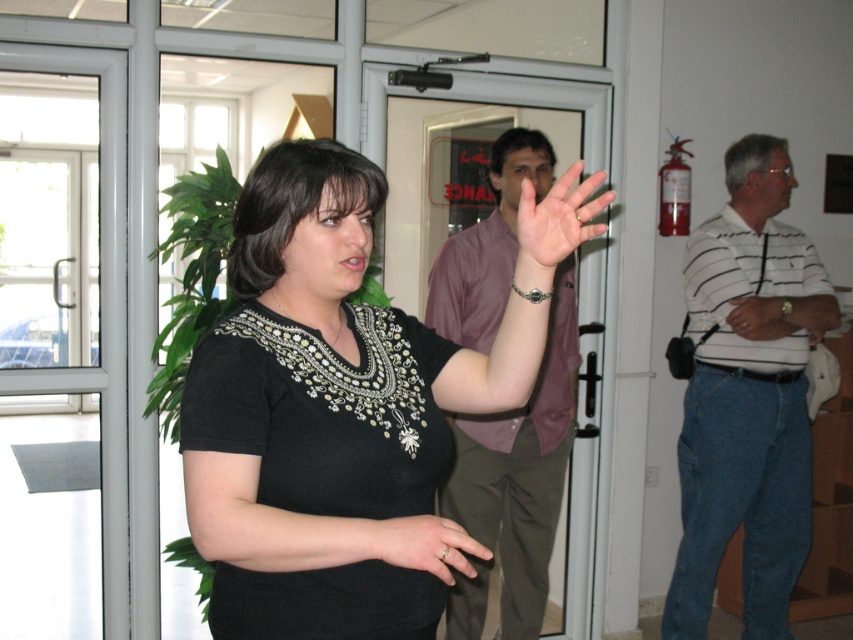
You are organizing a charity event and need to arrange two shirts on a display rack. The white striped shirt at right and the purple satin shirt at center must be placed side by side. Which shirt should you place on the left side to ensure they fit within the rack without overlapping?

The purple satin shirt at center should be placed on the left side because the white striped shirt at right might be wider, so placing the wider shirt on the right would allow both to fit without overlapping.